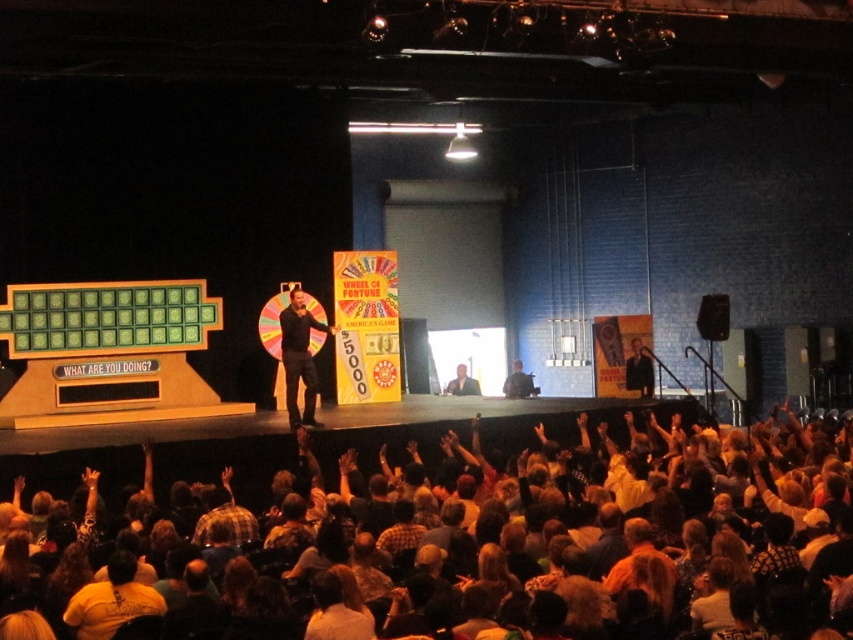
Does matte black suit at center have a lesser height compared to dark brown leather hand at upper center?

Incorrect, matte black suit at center's height does not fall short of dark brown leather hand at upper center's.

Can you confirm if matte black suit at center is positioned above dark brown leather hand at upper center?

Yes.

Does point (291, 368) come farther from viewer compared to point (228, 484)?

Yes, it is behind point (228, 484).

What are the coordinates of `matte black suit at center` in the screenshot? It's located at (299, 356).

Is plaid fabric shirt at lower center shorter than camouflage fabric shirt at center?

Indeed, plaid fabric shirt at lower center has a lesser height compared to camouflage fabric shirt at center.

Based on the photo, does plaid fabric shirt at lower center appear on the right side of camouflage fabric shirt at center?

No, plaid fabric shirt at lower center is not to the right of camouflage fabric shirt at center.

Between point (195, 536) and point (511, 385), which one is positioned behind?

The point (511, 385) is behind.

Where is `plaid fabric shirt at lower center`? The width and height of the screenshot is (853, 640). plaid fabric shirt at lower center is located at coordinates (224, 515).

From the picture: Is dark brown hair at lower center shorter than plaid fabric shirt at lower center?

In fact, dark brown hair at lower center may be taller than plaid fabric shirt at lower center.

Who is positioned more to the right, dark brown hair at lower center or plaid fabric shirt at lower center?

dark brown hair at lower center is more to the right.

Find the location of `dark brown hair at lower center`. dark brown hair at lower center is located at coordinates (552, 544).